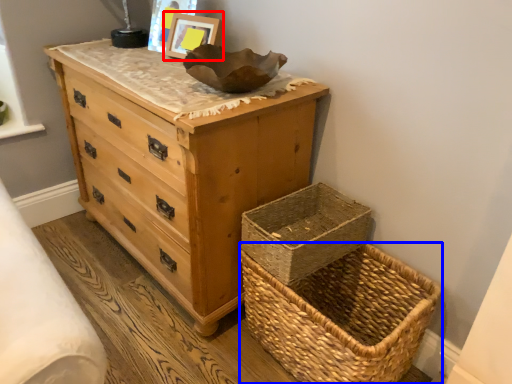
Question: Which of the following is the closest to the observer, picture frame (highlighted by a red box) or picnic basket (highlighted by a blue box)?

Choices:
 (A) picture frame
 (B) picnic basket

Answer: (B)